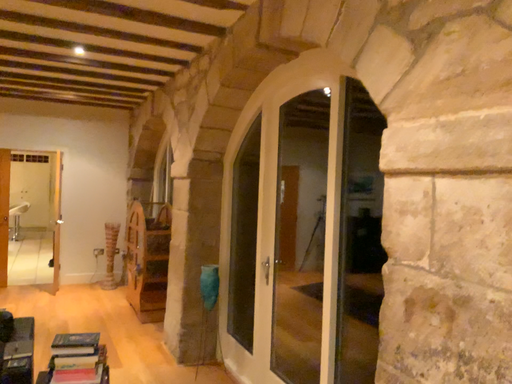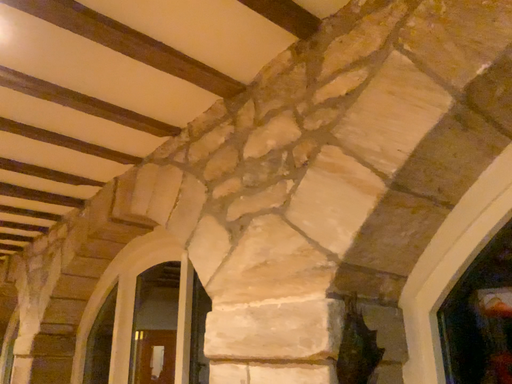
Question: Which way did the camera rotate in the video?

Choices:
 (A) rotated upward
 (B) rotated downward

Answer: (A)